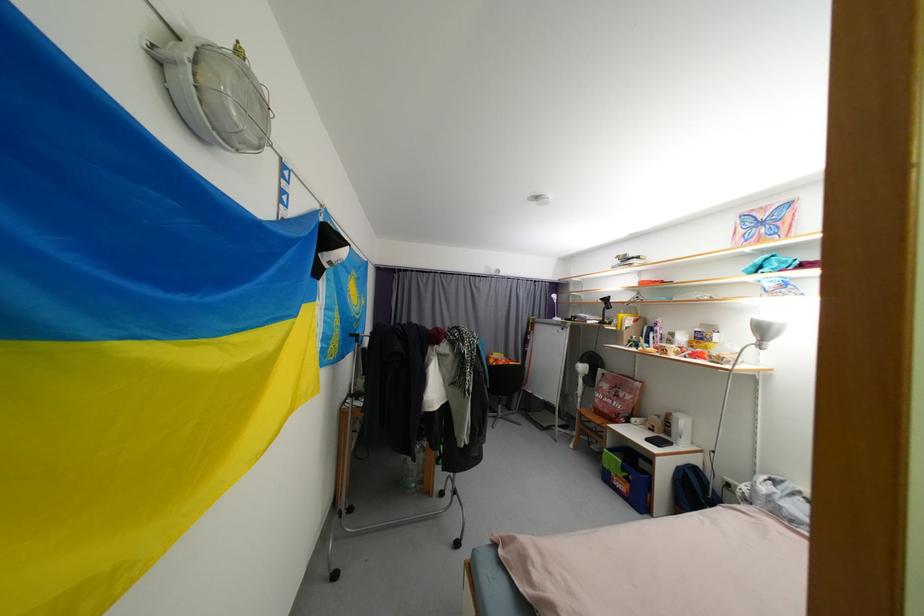
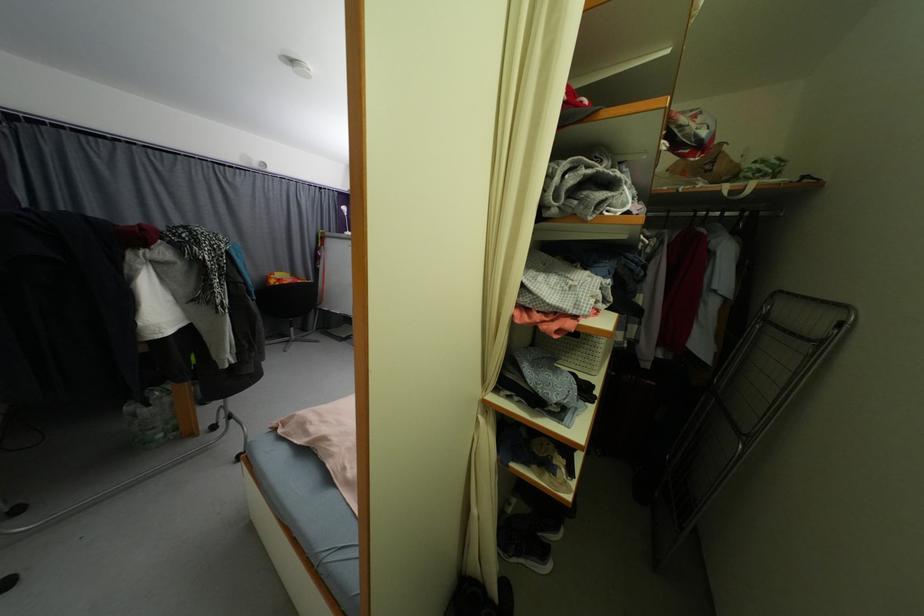
Where in the second image is the point corresponding to point (419, 463) from the first image?

(154, 407)